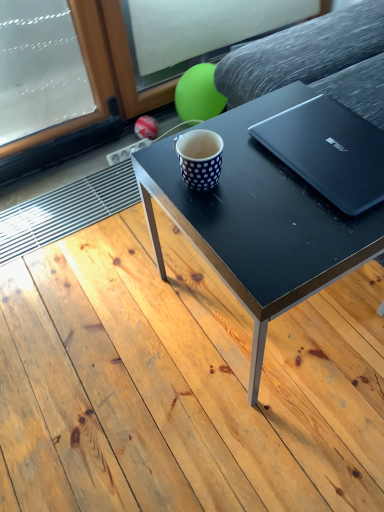
This screenshot has width=384, height=512. I want to click on vacant space that's between white dotted mug at center and black matte laptop at upper right, so click(264, 183).